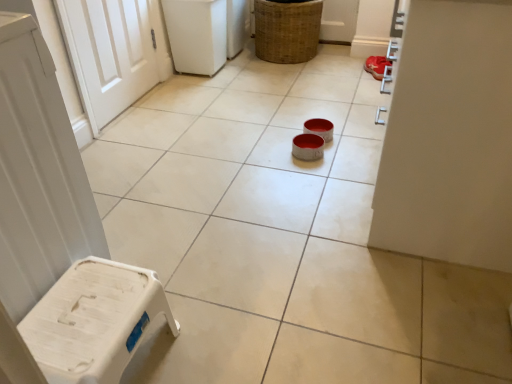
Question: From the image's perspective, is white plastic stool at lower left on woven brown basket at upper center?

Choices:
 (A) yes
 (B) no

Answer: (B)

Question: Is white plastic stool at lower left smaller than woven brown basket at upper center?

Choices:
 (A) no
 (B) yes

Answer: (B)

Question: Can you confirm if white plastic stool at lower left is taller than woven brown basket at upper center?

Choices:
 (A) no
 (B) yes

Answer: (A)

Question: Is white plastic stool at lower left at the right side of woven brown basket at upper center?

Choices:
 (A) no
 (B) yes

Answer: (A)

Question: Can you confirm if white plastic stool at lower left is bigger than woven brown basket at upper center?

Choices:
 (A) yes
 (B) no

Answer: (B)

Question: Does white plastic stool at lower left appear on the left side of woven brown basket at upper center?

Choices:
 (A) yes
 (B) no

Answer: (A)

Question: Is red suede shoe at upper right aimed at white plastic stool at lower left?

Choices:
 (A) no
 (B) yes

Answer: (A)

Question: Is red suede shoe at upper right not near white plastic stool at lower left?

Choices:
 (A) yes
 (B) no

Answer: (A)

Question: Is red suede shoe at upper right taller than white plastic stool at lower left?

Choices:
 (A) yes
 (B) no

Answer: (B)

Question: Does red suede shoe at upper right contain white plastic stool at lower left?

Choices:
 (A) yes
 (B) no

Answer: (B)

Question: Can you confirm if red suede shoe at upper right is positioned to the left of white plastic stool at lower left?

Choices:
 (A) no
 (B) yes

Answer: (A)

Question: Does red suede shoe at upper right have a greater width compared to white plastic stool at lower left?

Choices:
 (A) no
 (B) yes

Answer: (A)

Question: Is woven brown basket at upper center not near white plastic stool at lower left?

Choices:
 (A) no
 (B) yes

Answer: (B)